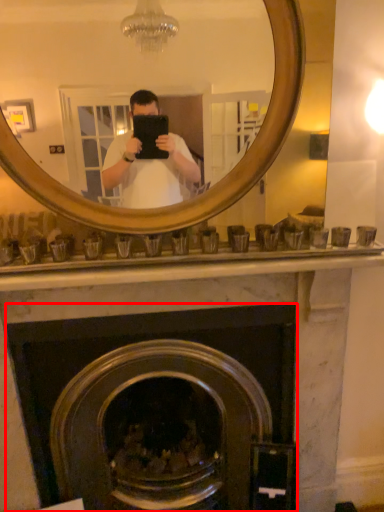
Question: Considering the relative positions of fireplace (annotated by the red box) and mirror in the image provided, where is fireplace (annotated by the red box) located with respect to the staircase?

Choices:
 (A) left
 (B) right

Answer: (A)